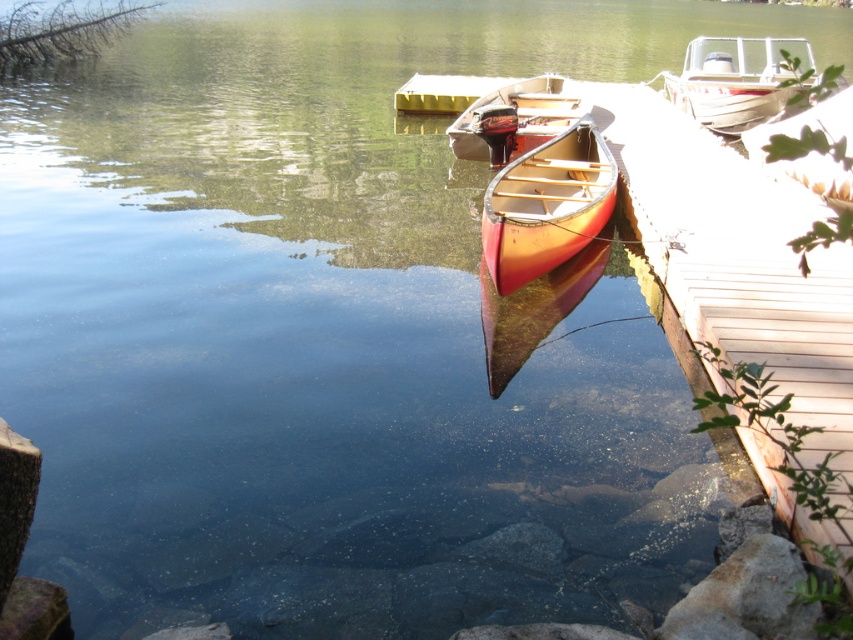
You are standing on the dock and want to board the white matte boat at upper right. Which direction should you move relative to the matte wood canoe at center?

The matte wood canoe at center is below the white matte boat at upper right, so you should move upward from the matte wood canoe at center to reach the white matte boat at upper right.

From the picture: You are standing on the dock and looking out at the water. There are two points marked on the dock. Which point, point (x=590, y=234) or point (x=767, y=72), is closer to you?

Point (x=590, y=234) is closer to the viewer than point (x=767, y=72).

You are standing on the dock and want to move to the matte wood canoe at center. What are the coordinates of the point you need to walk to?

The coordinates of the point you need to walk to are at (546, 205).